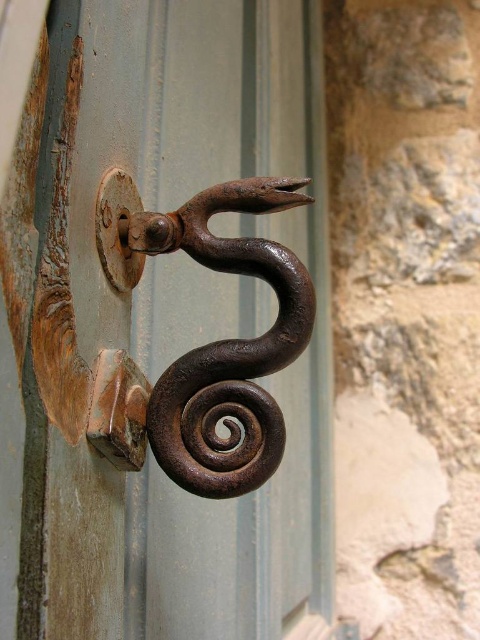
Who is more forward, (x=226, y=570) or (x=146, y=420)?

Point (x=146, y=420)

What do you see at coordinates (168, 328) in the screenshot? I see `rusty metal hook at center` at bounding box center [168, 328].

I want to click on rusty metal hook at center, so click(x=168, y=328).